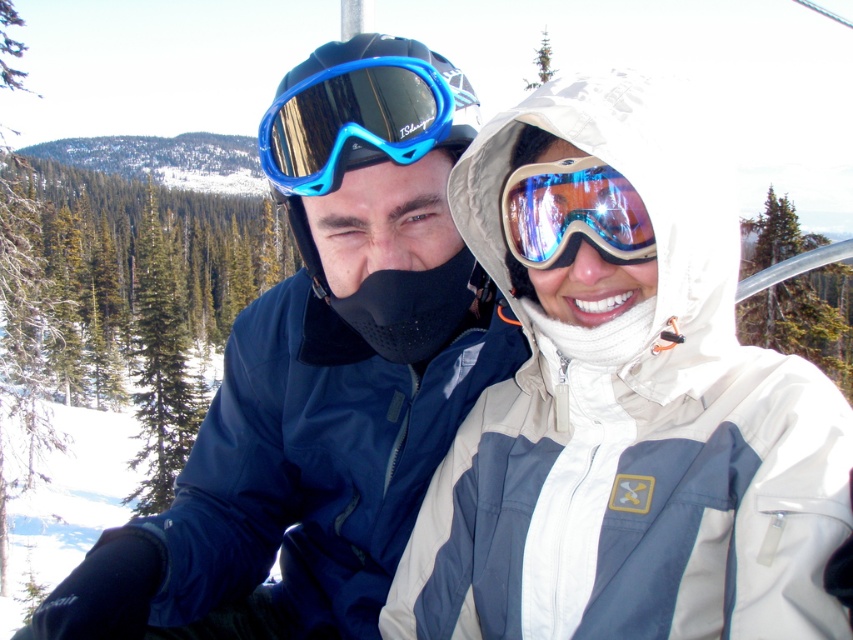
Question: Which point is closer to the camera?

Choices:
 (A) shiny reflective ski goggles at center
 (B) white matte jacket at center
 (C) matte blue ski goggles at center
 (D) blue reflective plastic goggles at upper center

Answer: (B)

Question: Based on their relative distances, which object is nearer to the white matte jacket at center?

Choices:
 (A) blue reflective plastic goggles at upper center
 (B) shiny reflective ski goggles at center

Answer: (B)

Question: Is white matte jacket at center to the right of shiny reflective ski goggles at center from the viewer's perspective?

Choices:
 (A) no
 (B) yes

Answer: (B)

Question: Which of the following is the farthest from the observer?

Choices:
 (A) matte blue ski goggles at center
 (B) shiny reflective ski goggles at center

Answer: (A)

Question: Is white matte jacket at center smaller than matte blue ski goggles at center?

Choices:
 (A) no
 (B) yes

Answer: (B)

Question: Can you confirm if white matte jacket at center is thinner than matte blue ski goggles at center?

Choices:
 (A) yes
 (B) no

Answer: (A)